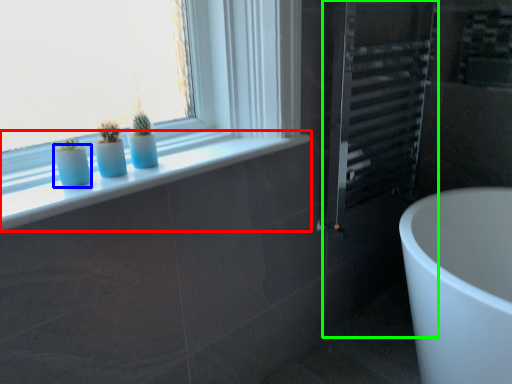
Question: Which is farther away from window sill (highlighted by a red box)? glass vase (highlighted by a blue box) or screen door (highlighted by a green box)?

Choices:
 (A) glass vase
 (B) screen door

Answer: (B)